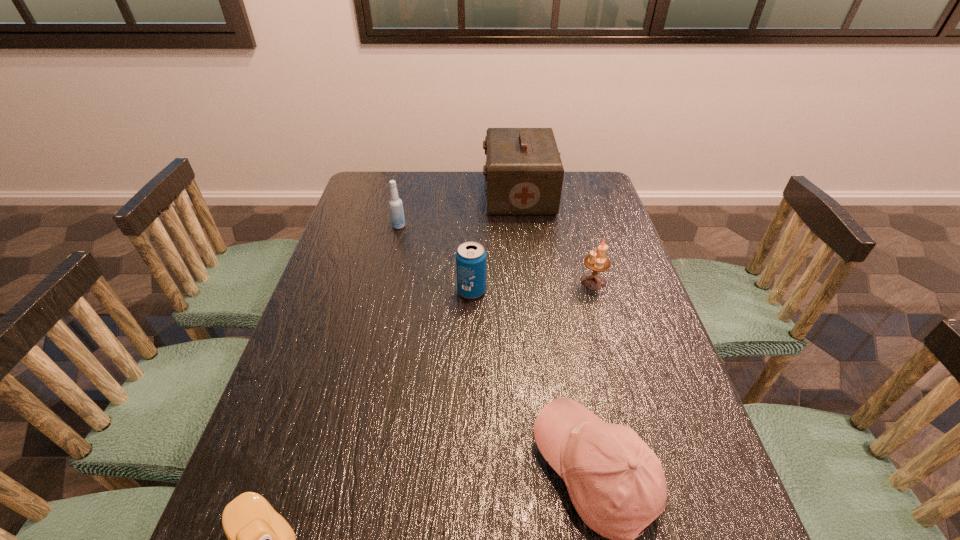
The image size is (960, 540). I want to click on unoccupied area between the soda can and the second farthest object, so click(x=435, y=259).

Where is `free space between the farthest object and the candle holder`? free space between the farthest object and the candle holder is located at coordinates (556, 237).

You are a GUI agent. You are given a task and a screenshot of the screen. Output one action in this format:
    pyautogui.click(x=<x>, y=<y>)
    Task: Click on the object that is the third closest to the soda can
    
    Given the screenshot: What is the action you would take?
    pyautogui.click(x=524, y=174)

Where is `object that stands as the fourth closest to the candle holder`? This screenshot has width=960, height=540. object that stands as the fourth closest to the candle holder is located at coordinates (395, 204).

This screenshot has height=540, width=960. In order to click on free spot that satisfies the following two spatial constraints: 1. on the front side of the tallest object; 2. on the right side of the candle holder in this screenshot , I will do `click(530, 281)`.

What are the coordinates of `vacant point that satisfies the following two spatial constraints: 1. on the back side of the second object from left to right; 2. on the left side of the first-aid kit` in the screenshot? It's located at (407, 193).